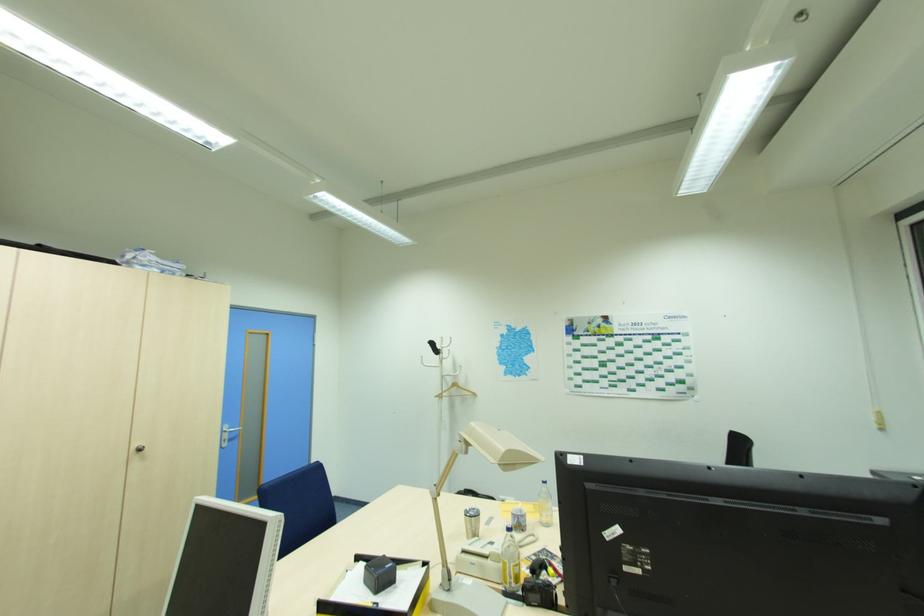
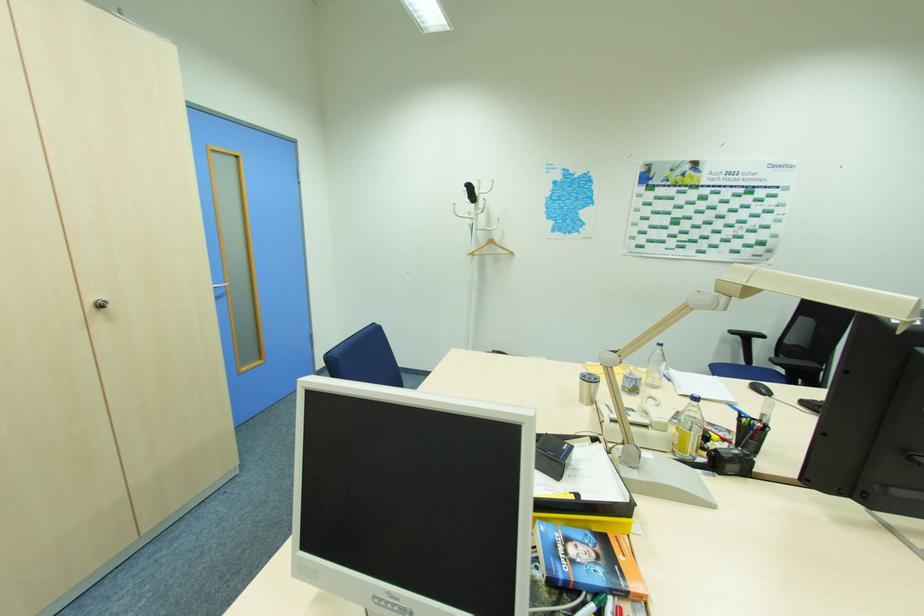
Locate, in the second image, the point that corresponds to (442,350) in the first image.

(479, 197)